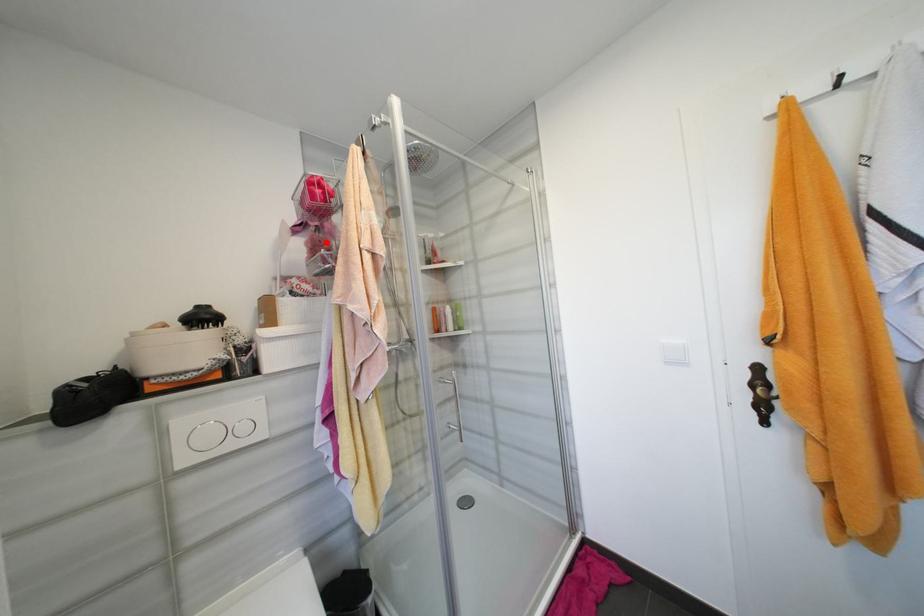
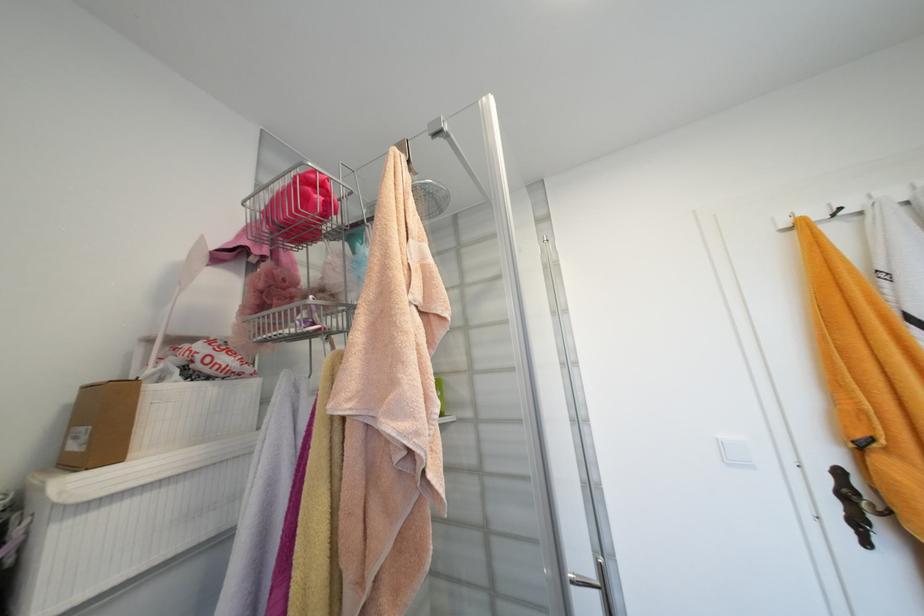
Question: I am providing you with two images of the same scene from different viewpoints. A red point is marked on the first image. Can you still see the location of the red point in image 2?

Choices:
 (A) Yes
 (B) No

Answer: (A)